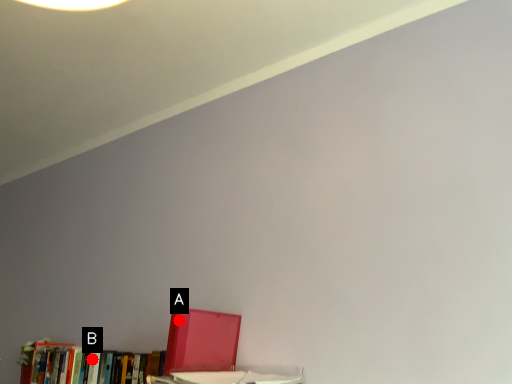
Question: Two points are circled on the image, labeled by A and B beside each circle. Which point appears closest to the camera in this image?

Choices:
 (A) A is closer
 (B) B is closer

Answer: (A)